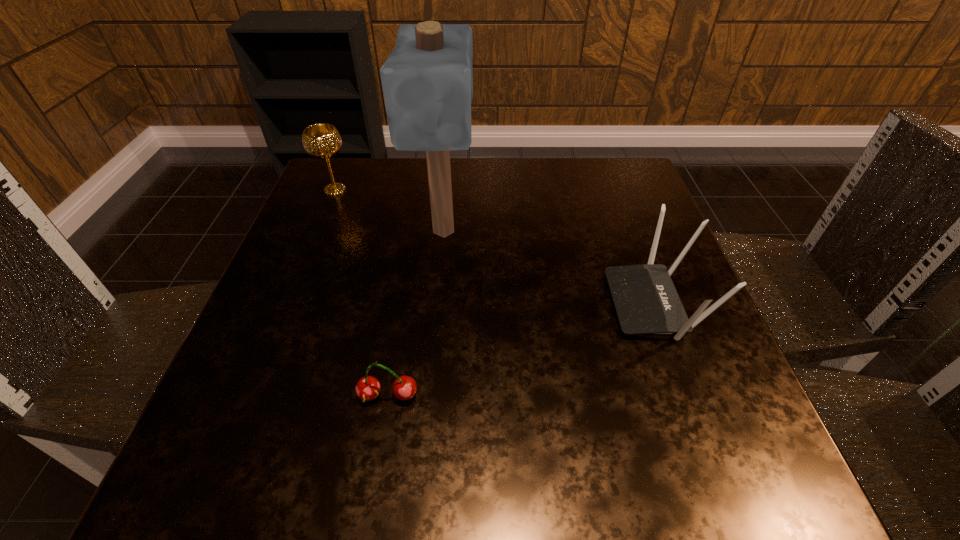
What are the coordinates of `vacant space located 0.330m on the front-facing side of the rightmost object` in the screenshot? It's located at (428, 303).

Image resolution: width=960 pixels, height=540 pixels. Identify the location of vacant region located with stems pointing upwards on the cherry. (380, 440).

This screenshot has height=540, width=960. Identify the location of mallet situated at the far edge. tap(427, 80).

Locate an element on the screen. chalice that is positioned at the far edge is located at coordinates (321, 141).

Image resolution: width=960 pixels, height=540 pixels. Identify the location of object that is positioned at the left edge. (321, 141).

The image size is (960, 540). I want to click on object that is positioned at the right edge, so click(x=646, y=302).

Locate an element on the screen. This screenshot has width=960, height=540. object at the far left corner is located at coordinates (321, 141).

Where is `vacant space at the far edge of the desktop`? This screenshot has width=960, height=540. vacant space at the far edge of the desktop is located at coordinates (522, 194).

In the image, there is a desktop. At what (x,y) coordinates should I click in order to perform the action: click on vacant area at the near edge. Please return your answer as a coordinate pair (x, y). Looking at the image, I should click on (468, 477).

Locate an element on the screen. The width and height of the screenshot is (960, 540). free space at the left edge of the desktop is located at coordinates (333, 269).